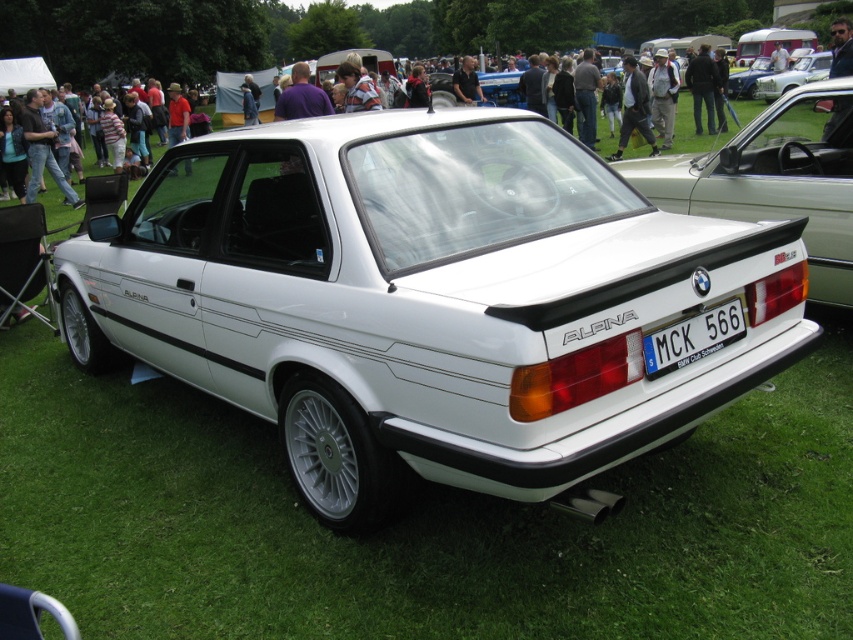
Question: From the image, what is the correct spatial relationship of white metallic car at center in relation to white glossy sedan at upper right?

Choices:
 (A) right
 (B) left

Answer: (B)

Question: Can you confirm if white matte rear wing at center is thinner than white plastic license plate at rear?

Choices:
 (A) no
 (B) yes

Answer: (A)

Question: Does white matte rear wing at center appear over metallic blue car at upper right?

Choices:
 (A) no
 (B) yes

Answer: (A)

Question: Among these objects, which one is nearest to the camera?

Choices:
 (A) white matte rear wing at center
 (B) white plastic license plate at rear
 (C) metallic blue car at upper right
 (D) white glossy sedan at upper right

Answer: (B)

Question: Which object is the closest to the white plastic license plate at rear?

Choices:
 (A) white metallic car at center
 (B) white matte rear wing at center

Answer: (A)

Question: Estimate the real-world distances between objects in this image. Which object is closer to the white glossy sedan at upper right?

Choices:
 (A) white matte rear wing at center
 (B) white metallic car at center

Answer: (A)